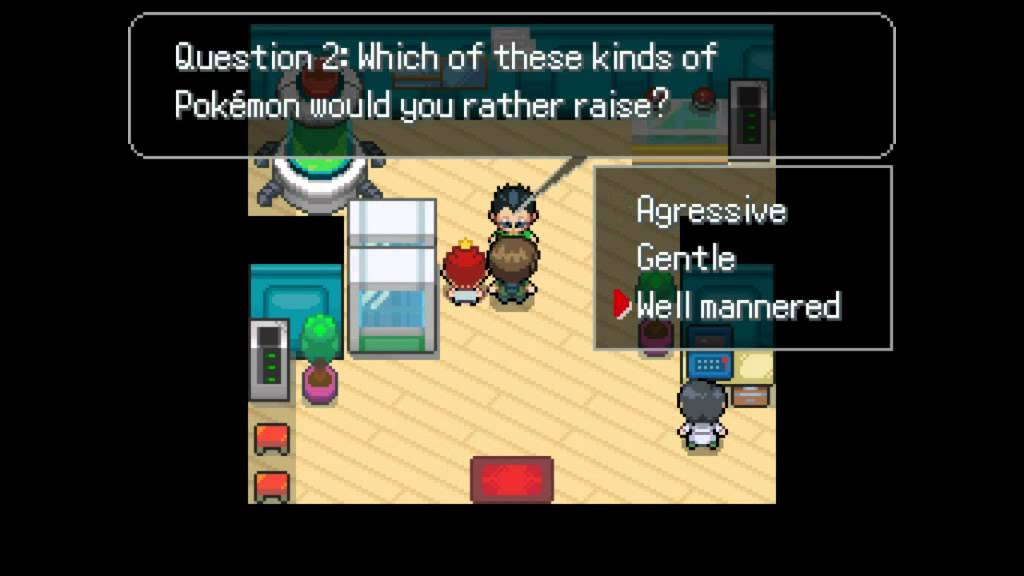
This screenshot has width=1024, height=576. Identify the location of computer. (703, 367).